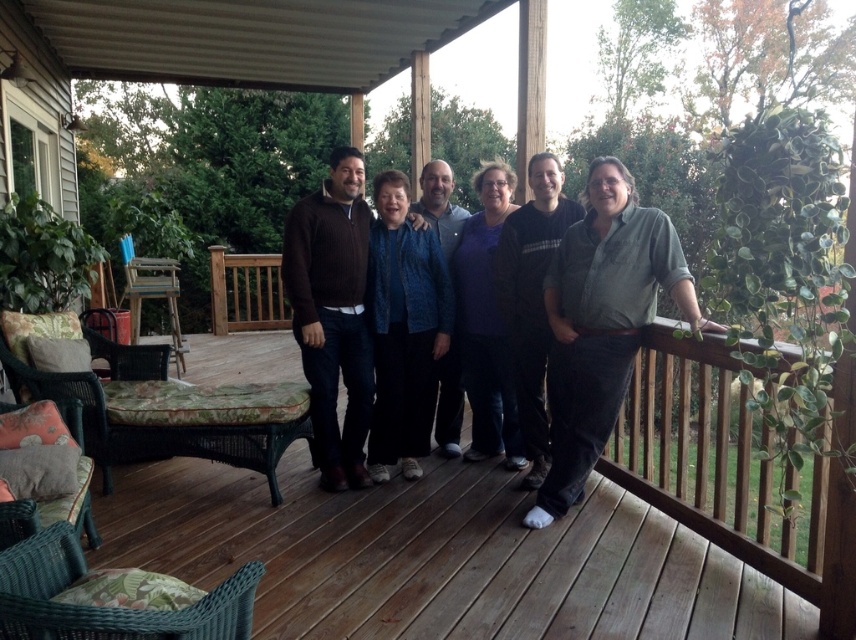
Which is above, wooden deck at center or green cotton shirt at right?

Positioned higher is green cotton shirt at right.

What do you see at coordinates (437, 557) in the screenshot?
I see `wooden deck at center` at bounding box center [437, 557].

What do you see at coordinates (437, 557) in the screenshot?
I see `wooden deck at center` at bounding box center [437, 557].

Find the location of `wooden deck at center`. wooden deck at center is located at coordinates (437, 557).

From the picture: Who is positioned more to the right, blue denim jeans at center or blue textured sweater at center?

Positioned to the right is blue denim jeans at center.

Image resolution: width=856 pixels, height=640 pixels. Identify the location of blue denim jeans at center. (599, 323).

Who is more distant from viewer, (596, 224) or (435, 182)?

Point (435, 182)

Find the location of `blue denim jeans at center`. blue denim jeans at center is located at coordinates (599, 323).

Who is positioned more to the left, green cotton shirt at right or brown sweater at center?

brown sweater at center is more to the left.

Can you confirm if green cotton shirt at right is taller than brown sweater at center?

In fact, green cotton shirt at right may be shorter than brown sweater at center.

At what (x,y) coordinates should I click in order to perform the action: click on green cotton shirt at right. Please return your answer as a coordinate pair (x, y). The image size is (856, 640). Looking at the image, I should click on (603, 323).

Where is `green cotton shirt at right`? The height and width of the screenshot is (640, 856). green cotton shirt at right is located at coordinates (603, 323).